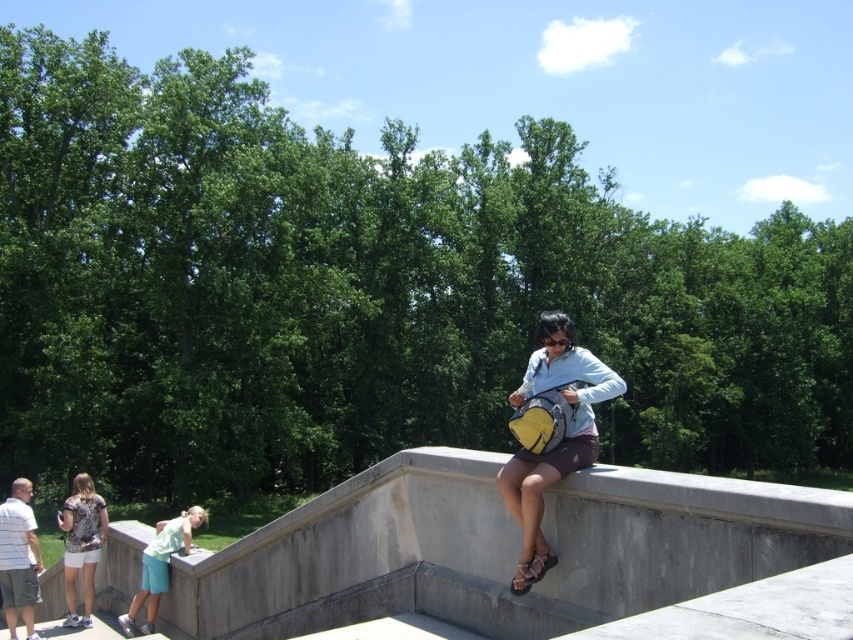
You are a photographer trying to capture both the matte yellow backpack at center and the printed fabric shirt at lower left in the same frame. Since the backpack is thinner than the shirt, which object would you need to move closer to the camera to ensure both appear equally wide in your photo?

Since the matte yellow backpack at center is thinner than the printed fabric shirt at lower left, you would need to move the matte yellow backpack at center closer to the camera so that both objects appear equally wide in the photo.

You are a photographer trying to capture a candid shot of the light blue denim shorts at lower left without the matte yellow backpack at center blocking the view. Can you adjust your position to do so?

The matte yellow backpack at center is closer to the viewer than the light blue denim shorts at lower left, so moving your camera position slightly behind or to the side of the backpack might allow you to see around it to capture the light blue denim shorts at lower left without obstruction.

You are standing on the concrete structure and want to place a new bench. The bench must be placed such that it is not directly below the matte yellow backpack at center. Where should you place the bench?

The bench should be placed anywhere except the point directly below the matte yellow backpack at center, which is at coordinates (560, 438).